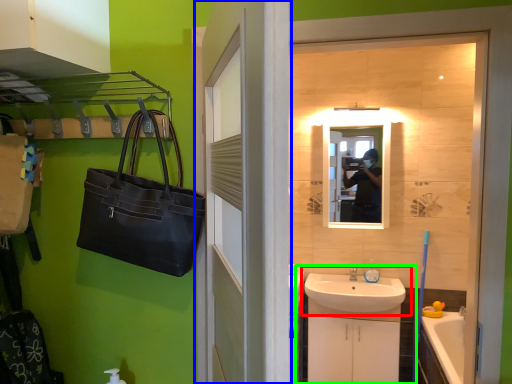
Question: Estimate the real-world distances between objects in this image. Which object is closer to sink (highlighted by a red box), door (highlighted by a blue box) or bathroom cabinet (highlighted by a green box)?

Choices:
 (A) door
 (B) bathroom cabinet

Answer: (B)